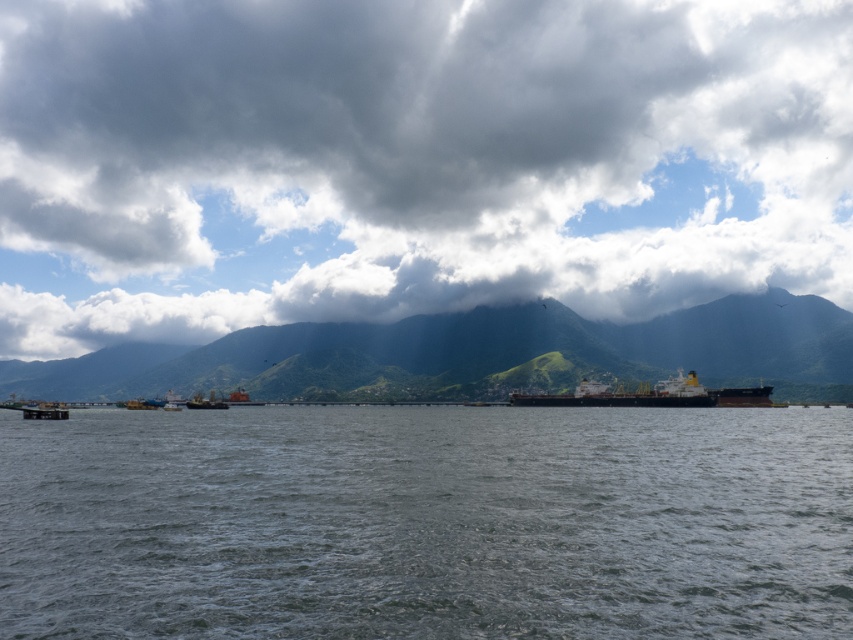
Based on the scene description, which object occupies a greater area in the image between the cloudy sky at upper center and the gray water at center?

The cloudy sky at upper center occupies a greater area in the image compared to the gray water at center as stated in the objects description.

You are standing on the pier and looking towards the water. Which object, the cloudy sky at upper center or the metallic gray boat at lower left, is positioned to the right when viewed from your perspective?

The cloudy sky at upper center is positioned to the right of the metallic gray boat at lower left.

You are a dock worker who needs to load cargo onto both the metallic gray boat at lower left and the metallic gray boat at center. Which boat has a larger deck area for cargo storage?

The metallic gray boat at lower left has a larger deck area for cargo storage since its width surpasses that of the metallic gray boat at center.